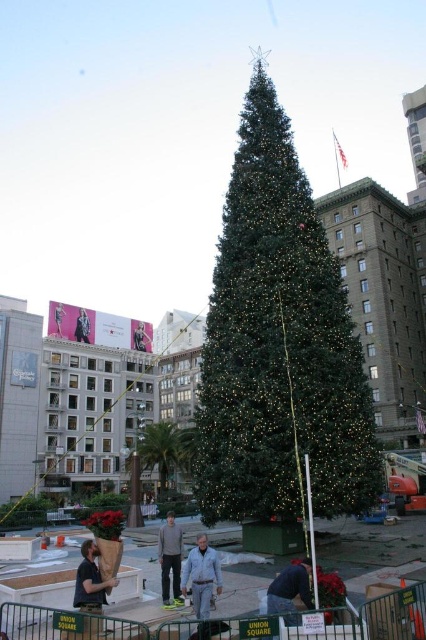
Does light blue denim jeans at center have a lesser height compared to matte black jacket at upper left?

Yes, light blue denim jeans at center is shorter than matte black jacket at upper left.

Which is below, light blue denim jeans at center or matte black jacket at upper left?

light blue denim jeans at center is lower down.

What do you see at coordinates (201, 577) in the screenshot? The height and width of the screenshot is (640, 426). I see `light blue denim jeans at center` at bounding box center [201, 577].

Find the location of `light blue denim jeans at center`. light blue denim jeans at center is located at coordinates (201, 577).

In the scene shown: Who is positioned more to the right, light blue denim jeans at center or black leather jacket at upper left?

light blue denim jeans at center

Can you confirm if light blue denim jeans at center is positioned above black leather jacket at upper left?

Incorrect, light blue denim jeans at center is not positioned above black leather jacket at upper left.

What do you see at coordinates (201, 577) in the screenshot?
I see `light blue denim jeans at center` at bounding box center [201, 577].

Where is `light blue denim jeans at center`? Image resolution: width=426 pixels, height=640 pixels. light blue denim jeans at center is located at coordinates (201, 577).

Does point (319, 480) come in front of point (161, 557)?

No, (319, 480) is behind (161, 557).

Which is behind, point (256, 321) or point (175, 525)?

The point (256, 321) is behind.

Where is `green matte christmas tree at center`? The image size is (426, 640). green matte christmas tree at center is located at coordinates (279, 346).